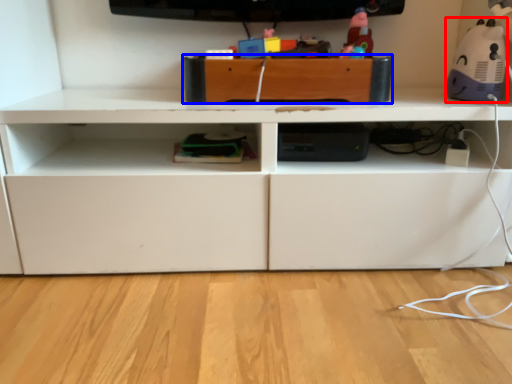
Question: Which object appears closest to the camera in this image, toy (highlighted by a red box) or drawer (highlighted by a blue box)?

Choices:
 (A) toy
 (B) drawer

Answer: (A)